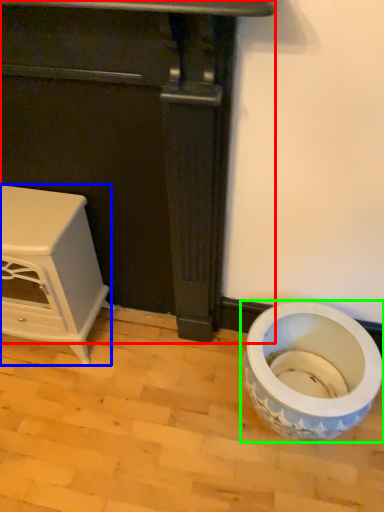
Question: Which object is positioned farthest from furniture (highlighted by a red box)? Select from furniture (highlighted by a blue box) and toilet (highlighted by a green box).

Choices:
 (A) furniture
 (B) toilet

Answer: (B)